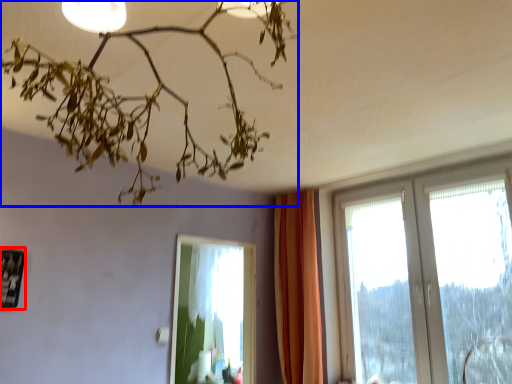
Question: Among these objects, which one is nearest to the camera, picture frame (highlighted by a red box) or lamp (highlighted by a blue box)?

Choices:
 (A) picture frame
 (B) lamp

Answer: (B)